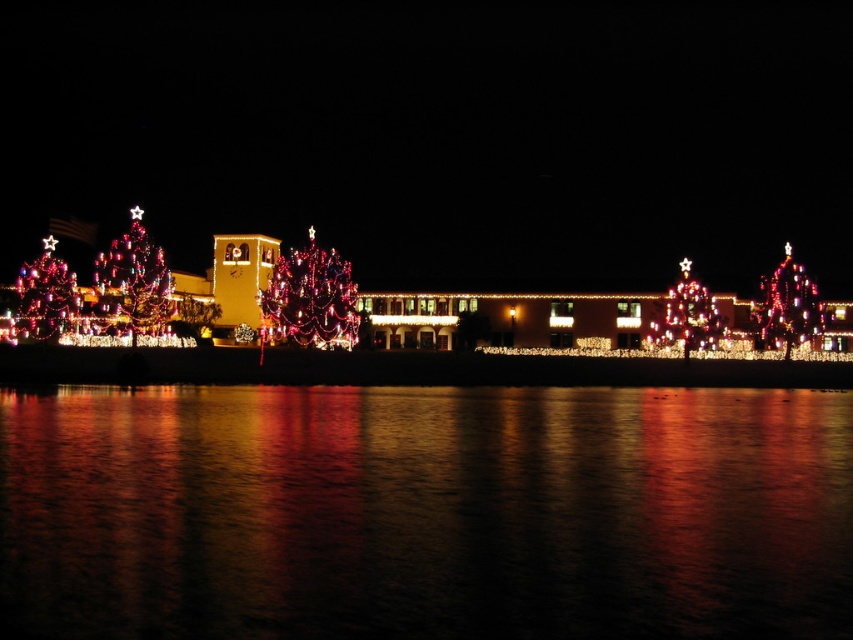
Does glossy reflective water at center have a smaller size compared to iridescent glass christmas tree at center?

No.

Who is shorter, glossy reflective water at center or iridescent glass christmas tree at center?

glossy reflective water at center is shorter.

Who is more forward, (x=648, y=612) or (x=347, y=278)?

Positioned in front is point (x=648, y=612).

At what (x,y) coordinates should I click in order to perform the action: click on glossy reflective water at center. Please return your answer as a coordinate pair (x, y). This screenshot has width=853, height=640. Looking at the image, I should click on (424, 512).

In the scene shown: Can you confirm if iridescent glass christmas tree at center is positioned below shiny red christmas tree at left?

Yes, iridescent glass christmas tree at center is below shiny red christmas tree at left.

Which is behind, point (259, 304) or point (136, 273)?

Positioned behind is point (259, 304).

Image resolution: width=853 pixels, height=640 pixels. Find the location of `iridescent glass christmas tree at center`. iridescent glass christmas tree at center is located at coordinates (310, 300).

Which is below, illuminated glass christmas tree at right or illuminated glass christmas tree at center?

illuminated glass christmas tree at center is lower down.

Who is more forward, (788, 324) or (708, 330)?

Point (708, 330) is in front.

This screenshot has height=640, width=853. Describe the element at coordinates (786, 307) in the screenshot. I see `illuminated glass christmas tree at right` at that location.

Identify the location of illuminated glass christmas tree at right. (786, 307).